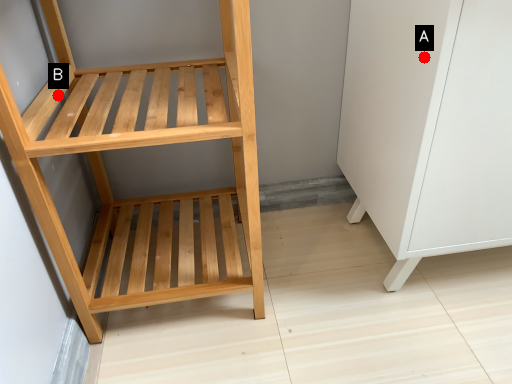
Question: Two points are circled on the image, labeled by A and B beside each circle. Which point appears farthest from the camera in this image?

Choices:
 (A) A is further
 (B) B is further

Answer: (B)